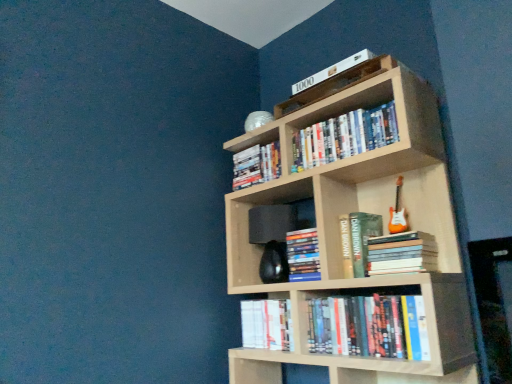
The image size is (512, 384). Describe the element at coordinates (362, 239) in the screenshot. I see `hardcover book at center, the 5th book positioned from the bottom` at that location.

This screenshot has width=512, height=384. Describe the element at coordinates (344, 136) in the screenshot. I see `hardcover books at upper center, which is the seventh book in bottom-to-top order` at that location.

Image resolution: width=512 pixels, height=384 pixels. Describe the element at coordinates (402, 253) in the screenshot. I see `hardcover books at center, placed as the fifth book when sorted from top to bottom` at that location.

Identify the location of hardcover books at center, the fourth book when ordered from bottom to top. This screenshot has width=512, height=384. (402, 253).

Where is `hardcover book at upper center, the third book viewed from the top`? The image size is (512, 384). hardcover book at upper center, the third book viewed from the top is located at coordinates (256, 165).

Consider the image. Between white paper book at lower center, the eighth book from the top, and light wood bookcase at upper center, which one has more height?

With more height is light wood bookcase at upper center.

Looking at the image, does white paper book at lower center, the first book in the bottom-to-top sequence, seem bigger or smaller compared to light wood bookcase at upper center?

white paper book at lower center, the first book in the bottom-to-top sequence, is smaller than light wood bookcase at upper center.

Considering the points (289, 339) and (330, 169), which point is in front, point (289, 339) or point (330, 169)?

The point (330, 169) is closer to the camera.

Which of these two, white paper book at lower center, the first book in the bottom-to-top sequence, or light wood bookcase at upper center, is thinner?

With smaller width is white paper book at lower center, the first book in the bottom-to-top sequence.

From a real-world perspective, who is located lower, hardcover books at center, placed as the fifth book when sorted from top to bottom, or black matte speaker at center?

hardcover books at center, placed as the fifth book when sorted from top to bottom, from a real-world perspective.

Locate an element on the screen. the 1st book positioned above the black matte speaker at center (from the image's perspective) is located at coordinates (402, 253).

From the image's perspective, relative to black matte speaker at center, is hardcover books at center, placed as the fifth book when sorted from top to bottom, above or below?

hardcover books at center, placed as the fifth book when sorted from top to bottom, is situated higher than black matte speaker at center in the image.

Consider the image. Considering the sizes of objects hardcover books at center, placed as the fifth book when sorted from top to bottom, and black matte speaker at center in the image provided, who is thinner, hardcover books at center, placed as the fifth book when sorted from top to bottom, or black matte speaker at center?

hardcover books at center, placed as the fifth book when sorted from top to bottom, is thinner.

Consider the image. Relative to hardcover books at lower center, the seventh book from the top, is black matte speaker at center in front or behind?

black matte speaker at center is behind hardcover books at lower center, the seventh book from the top.

Consider the image. Is black matte speaker at center in contact with hardcover books at lower center, the seventh book from the top?

No, black matte speaker at center is not with hardcover books at lower center, the seventh book from the top.

Looking at this image, considering the sizes of objects black matte speaker at center and hardcover books at lower center, which appears as the second book when ordered from the bottom, in the image provided, who is shorter, black matte speaker at center or hardcover books at lower center, which appears as the second book when ordered from the bottom,?

hardcover books at lower center, which appears as the second book when ordered from the bottom, is shorter.

Does black matte speaker at center have a greater width compared to hardcover books at lower center, the seventh book from the top?

Yes.

Between white matte book at upper center, the 1th book viewed from the top, and hardcover book at center, which appears as the third book when ordered from the bottom, which one has larger size?

With larger size is hardcover book at center, which appears as the third book when ordered from the bottom.

Considering the sizes of objects white matte book at upper center, the 8th book from the bottom, and hardcover book at center, which appears as the third book when ordered from the bottom, in the image provided, who is wider, white matte book at upper center, the 8th book from the bottom, or hardcover book at center, which appears as the third book when ordered from the bottom,?

white matte book at upper center, the 8th book from the bottom.

Is white matte book at upper center, the 8th book from the bottom, next to hardcover book at center, the sixth book positioned from the top?

No, white matte book at upper center, the 8th book from the bottom, is not in contact with hardcover book at center, the sixth book positioned from the top.

From the image's perspective, between white matte book at upper center, the 8th book from the bottom, and hardcover book at center, the sixth book positioned from the top, which one is located above?

white matte book at upper center, the 8th book from the bottom, from the image's perspective.

Considering the sizes of objects white paper book at lower center, the eighth book from the top, and hardcover books at upper center, the 2th book from the top, in the image provided, who is taller, white paper book at lower center, the eighth book from the top, or hardcover books at upper center, the 2th book from the top,?

With more height is white paper book at lower center, the eighth book from the top.

You are a GUI agent. You are given a task and a screenshot of the screen. Output one action in this format:
    pyautogui.click(x=<x>, y=<y>)
    Task: Click on the 4th book behind the hardcover books at upper center, which is the seventh book in bottom-to-top order, counting from the anchor's position
    This screenshot has height=384, width=512.
    Given the screenshot: What is the action you would take?
    pyautogui.click(x=267, y=324)

From a real-world perspective, does white paper book at lower center, the first book in the bottom-to-top sequence, stand above hardcover books at upper center, which is the seventh book in bottom-to-top order?

No, from a real-world perspective, white paper book at lower center, the first book in the bottom-to-top sequence, is not over hardcover books at upper center, which is the seventh book in bottom-to-top order

In the scene shown: Is white matte book at upper center, the 1th book viewed from the top, at the right side of white paper book at lower center, the first book in the bottom-to-top sequence?

Yes, white matte book at upper center, the 1th book viewed from the top, is to the right of white paper book at lower center, the first book in the bottom-to-top sequence.

In the scene shown: Between white matte book at upper center, the 8th book from the bottom, and white paper book at lower center, the eighth book from the top, which one has smaller size?

white matte book at upper center, the 8th book from the bottom, is smaller.

Is white matte book at upper center, the 8th book from the bottom, further to camera compared to white paper book at lower center, the eighth book from the top?

Answer: No.

Considering the sizes of objects white matte book at upper center, the 1th book viewed from the top, and white paper book at lower center, the eighth book from the top, in the image provided, who is taller, white matte book at upper center, the 1th book viewed from the top, or white paper book at lower center, the eighth book from the top,?

white paper book at lower center, the eighth book from the top.

Based on the photo, how different are the orientations of hardcover books at lower center, which appears as the second book when ordered from the bottom, and white paper book at lower center, the eighth book from the top, in degrees?

They differ by 0.683 degrees in their facing directions.

Is hardcover books at lower center, which appears as the second book when ordered from the bottom, taller or shorter than white paper book at lower center, the eighth book from the top?

In the image, hardcover books at lower center, which appears as the second book when ordered from the bottom, appears to be taller than white paper book at lower center, the eighth book from the top.

Would you say hardcover books at lower center, the seventh book from the top, is outside white paper book at lower center, the eighth book from the top?

Yes.

Locate an element on the screen. Image resolution: width=512 pixels, height=384 pixels. the 4th book to the right of the white paper book at lower center, the eighth book from the top, starting your count from the anchor is located at coordinates (369, 326).

I want to click on the 2nd book to the left when counting from the light wood bookcase at upper center, so click(x=267, y=324).

Identify the location of the 6th book to the right of the black matte speaker at center, starting your count from the anchor. The width and height of the screenshot is (512, 384). (402, 253).

Based on their spatial positions, is hardcover book at center, the 5th book positioned from the bottom, or hardcover book at upper center, the third book viewed from the top, closer to white paper book at lower center, the first book in the bottom-to-top sequence?

hardcover book at center, the 5th book positioned from the bottom, lies closer to white paper book at lower center, the first book in the bottom-to-top sequence, than the other object.

Looking at the image, which one is located further to hardcover books at upper center, which is the seventh book in bottom-to-top order, white matte book at upper center, the 1th book viewed from the top, or black matte speaker at center?

Based on the image, black matte speaker at center appears to be further to hardcover books at upper center, which is the seventh book in bottom-to-top order.

From the image, which object appears to be farther from black matte speaker at center, white matte book at upper center, the 1th book viewed from the top, or hardcover book at upper center, which is the 6th book from bottom to top?

white matte book at upper center, the 1th book viewed from the top, lies further to black matte speaker at center than the other object.

Considering their positions, is white paper book at lower center, the eighth book from the top, positioned further to hardcover book at upper center, which is the 6th book from bottom to top, than black matte speaker at center?

white paper book at lower center, the eighth book from the top, is positioned further to the anchor hardcover book at upper center, which is the 6th book from bottom to top.

From the picture: When comparing their distances from light wood bookcase at upper center, does hardcover books at lower center, the seventh book from the top, or hardcover book at center, the 5th book positioned from the bottom, seem further?

Based on the image, hardcover book at center, the 5th book positioned from the bottom, appears to be further to light wood bookcase at upper center.

Which object lies further to the anchor point hardcover book at center, the sixth book positioned from the top, hardcover book at upper center, which is the 6th book from bottom to top, or hardcover books at lower center, the seventh book from the top?

hardcover book at upper center, which is the 6th book from bottom to top.

When comparing their distances from hardcover books at upper center, which is the seventh book in bottom-to-top order, does hardcover books at lower center, which appears as the second book when ordered from the bottom, or black matte speaker at center seem closer?

Based on the image, black matte speaker at center appears to be nearer to hardcover books at upper center, which is the seventh book in bottom-to-top order.

Considering their positions, is hardcover books at upper center, the 2th book from the top, positioned closer to hardcover books at lower center, the seventh book from the top, than black matte speaker at center?

Based on the image, black matte speaker at center appears to be nearer to hardcover books at lower center, the seventh book from the top.

Where is `shelf between white matte book at upper center, the 8th book from the bottom, and hardcover book at center, which appears as the third book when ordered from the bottom, in the up-down direction`? The height and width of the screenshot is (384, 512). shelf between white matte book at upper center, the 8th book from the bottom, and hardcover book at center, which appears as the third book when ordered from the bottom, in the up-down direction is located at coordinates (248, 229).

In order to click on shelf between hardcover book at upper center, which is the 6th book from bottom to top, and white paper book at lower center, the first book in the bottom-to-top sequence, in the vertical direction in this screenshot , I will do `click(248, 229)`.

In order to click on shelf that lies between hardcover books at upper center, which is the seventh book in bottom-to-top order, and hardcover books at lower center, the seventh book from the top, from top to bottom in this screenshot , I will do pos(248,229).

Locate an element on the screen. shelf between hardcover book at upper center, the third book viewed from the top, and hardcover books at center, placed as the fifth book when sorted from top to bottom, in the horizontal direction is located at coordinates (248, 229).